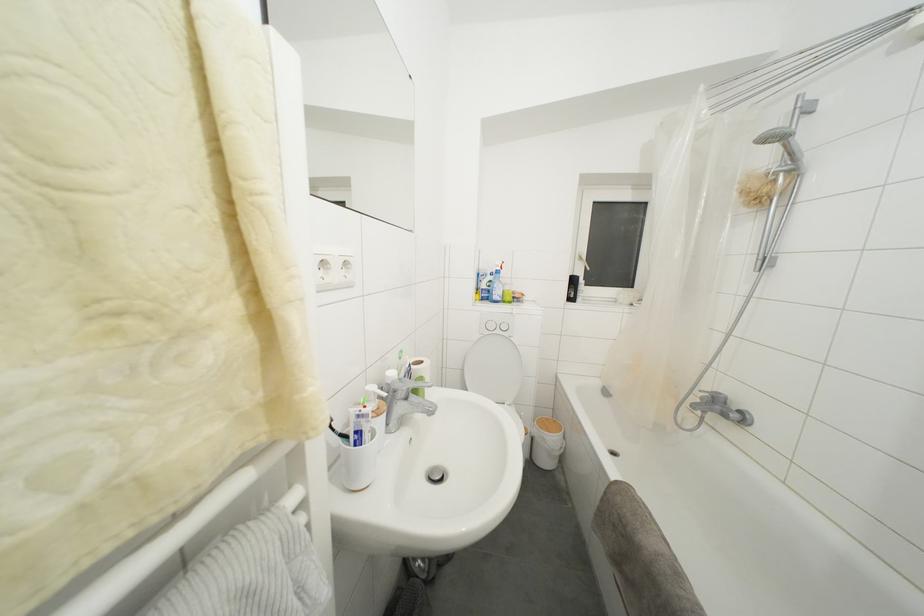
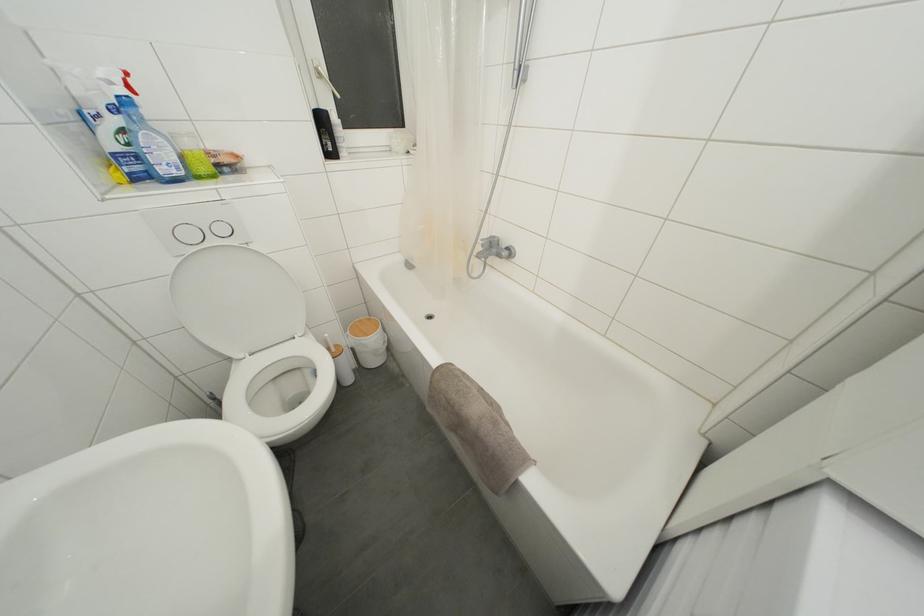
The point at (578, 286) is marked in the first image. Where is the corresponding point in the second image?

(325, 126)